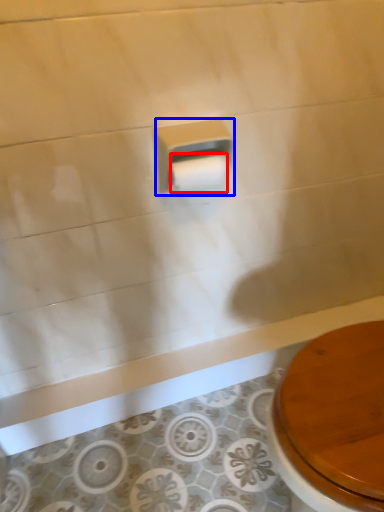
Question: Among these objects, which one is nearest to the camera, toilet paper (highlighted by a red box) or toilet paper (highlighted by a blue box)?

Choices:
 (A) toilet paper
 (B) toilet paper

Answer: (B)